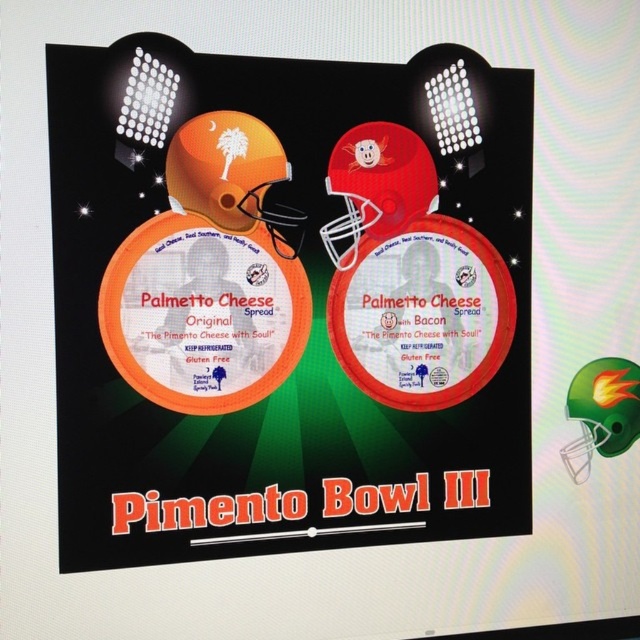
What do you see at coordinates (284, 300) in the screenshot? I see `orange matte helmet at upper center` at bounding box center [284, 300].

Which of these two, orange matte helmet at upper center or matte red helmet at center, stands shorter?

With less height is matte red helmet at center.

Identify the location of orange matte helmet at upper center. (284, 300).

Identify the location of orange matte helmet at upper center. (284, 300).

Locate an element on the screen. The width and height of the screenshot is (640, 640). matte red helmet at center is located at coordinates click(378, 186).

Is point (344, 147) farther from camera compared to point (253, 225)?

That is True.

Where is `matte red helmet at center`? This screenshot has width=640, height=640. matte red helmet at center is located at coordinates (378, 186).

Between point (317, 369) and point (205, 150), which one is positioned in front?

Point (205, 150) is more forward.

Between orange matte helmet at upper center and orange matte helmet at upper left, which one is positioned lower?

orange matte helmet at upper center is below.

Between point (470, 513) and point (221, 150), which one is positioned in front?

Point (221, 150)

Where is `orange matte helmet at upper center`? This screenshot has width=640, height=640. orange matte helmet at upper center is located at coordinates (284, 300).